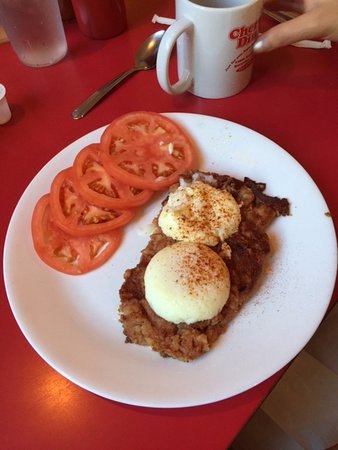
This screenshot has height=450, width=338. Find the location of `plate`. plate is located at coordinates (266, 362).